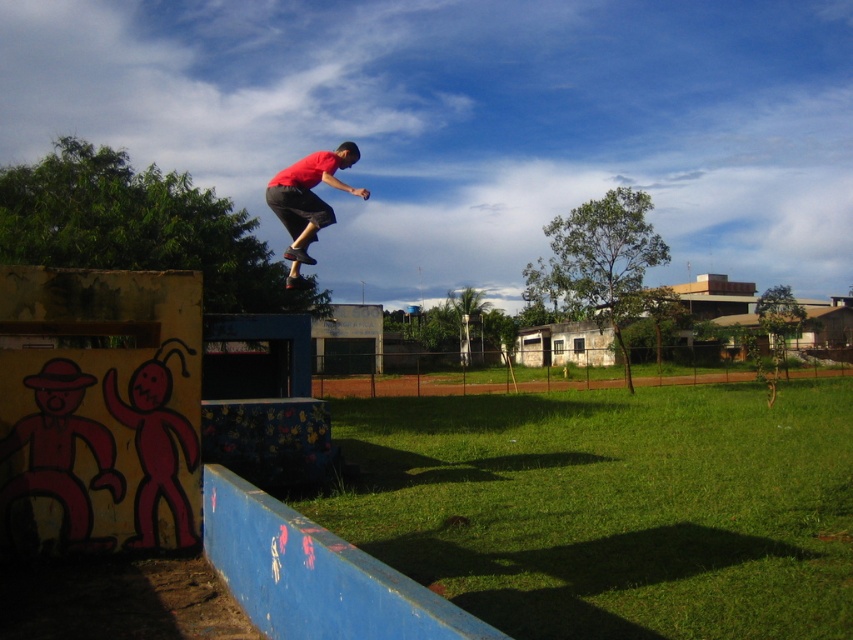
You are a photographer trying to capture the person in the scene. Since the matte red shirt at center and the wooden brown skateboard at center are both in the frame, which object should you focus on to ensure the person is clearly visible?

The matte red shirt at center has a larger size compared to the wooden brown skateboard at center, so focusing on the matte red shirt at center will ensure the person is clearly visible because it is bigger and more prominent.